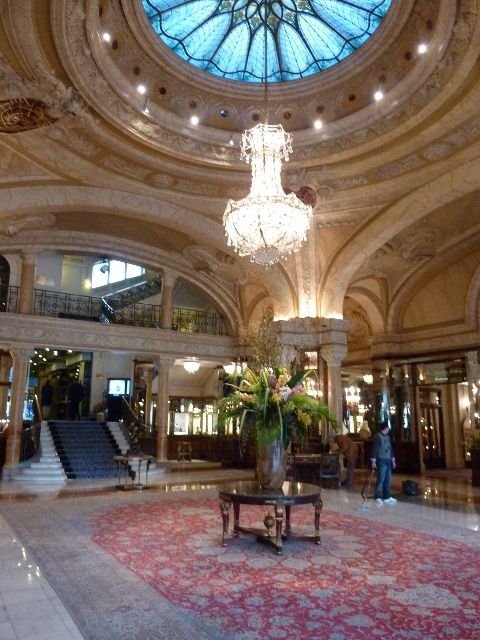
You are standing at the entrance of the grand building and want to locate the blue stained glass dome at center. According to the coordinates provided, where should you look?

You should look at point (x=264, y=33) to find the blue stained glass dome at center.

You are an interior designer planning to install a new lighting fixture in the grand building. The blue stained glass dome at center and the crystal glass chandelier at center are both in the central area. Which object has a larger width?

The blue stained glass dome at center has a larger width than the crystal glass chandelier at center according to the description.